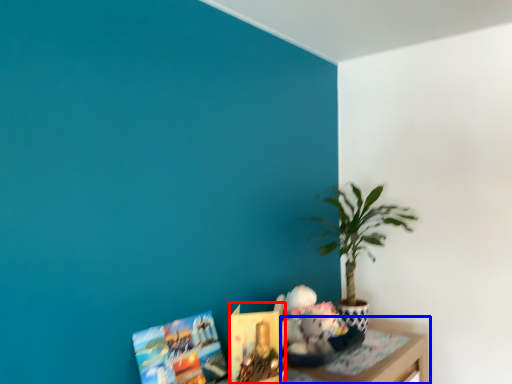
Question: Which of the following is the closest to the observer, book (highlighted by a red box) or table (highlighted by a blue box)?

Choices:
 (A) book
 (B) table

Answer: (A)